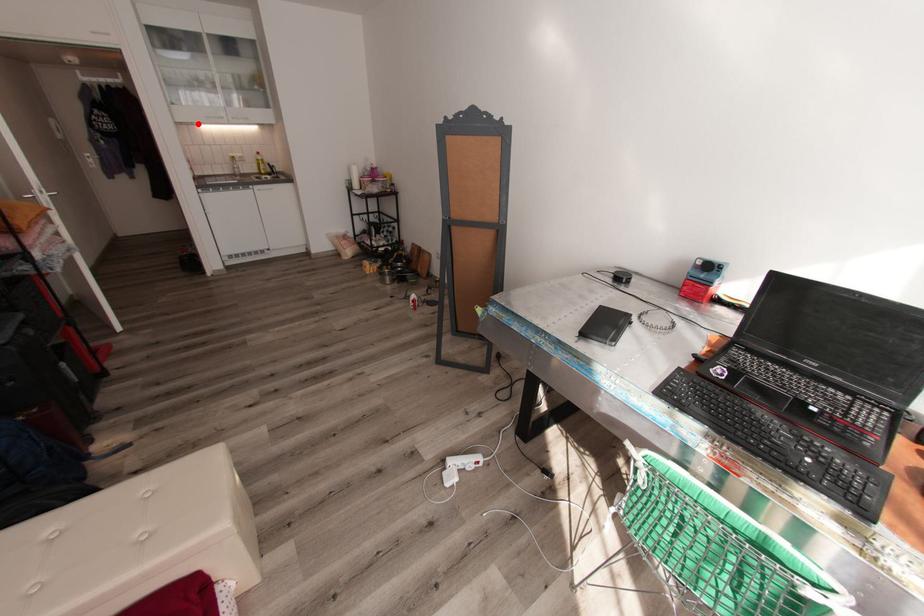
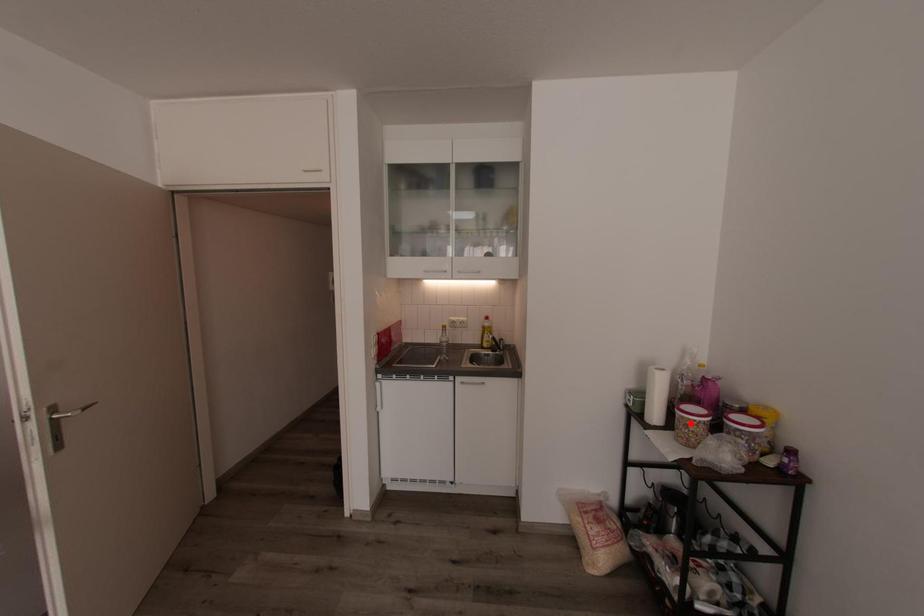
I am providing you with two images of the same scene from different viewpoints. A red point is marked on the first image and another point is marked on the second image. Is the red point in image1 aligned with the point shown in image2?

No